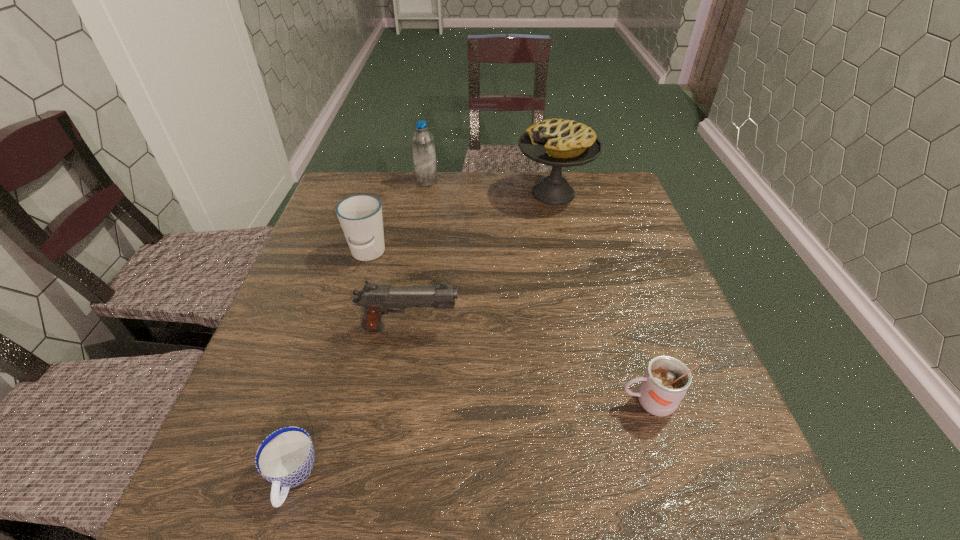
Locate an element on the screen. Image resolution: width=960 pixels, height=540 pixels. object that stands as the third closest to the water bottle is located at coordinates (376, 300).

This screenshot has height=540, width=960. Find the location of `object that can be found as the fifth closest to the water bottle`. object that can be found as the fifth closest to the water bottle is located at coordinates (285, 458).

In order to click on the closest cup to the shortest object in this screenshot , I will do `click(360, 216)`.

Identify the location of cup that can be found as the second closest to the tallest cup. (666, 380).

The image size is (960, 540). Identify the location of vacant space that satisfies the following two spatial constraints: 1. on the cut side of the pie; 2. on the side of the shortest cup with the handle. (617, 478).

Identify the location of free spot that satisfies the following two spatial constraints: 1. on the cut side of the pie; 2. with a handle on the side of the farthest cup. The image size is (960, 540). (567, 254).

Where is `free point that satisfies the following two spatial constraints: 1. in the direction the gun is aimed; 2. on the side of the nearest cup with the handle`? Image resolution: width=960 pixels, height=540 pixels. free point that satisfies the following two spatial constraints: 1. in the direction the gun is aimed; 2. on the side of the nearest cup with the handle is located at coordinates (387, 478).